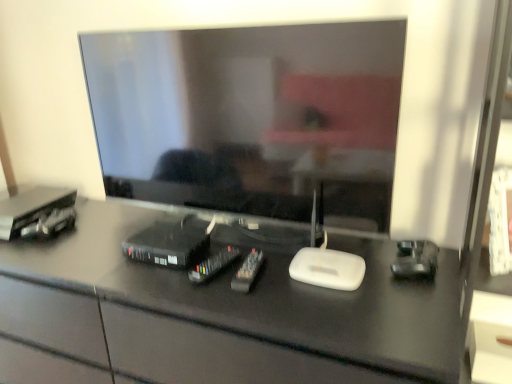
Question: Can you confirm if matte white drawer at lower right is positioned to the right of black plastic remote controls at center, the 4th equipment when ordered from left to right?

Choices:
 (A) no
 (B) yes

Answer: (B)

Question: Is matte white drawer at lower right wider than black plastic remote controls at center, the 4th equipment when ordered from left to right?

Choices:
 (A) no
 (B) yes

Answer: (A)

Question: Is matte white drawer at lower right shorter than black plastic remote controls at center, the 1th equipment when ordered from right to left?

Choices:
 (A) no
 (B) yes

Answer: (A)

Question: Is black plastic remote controls at center, the 4th equipment when ordered from left to right, at the back of matte white drawer at lower right?

Choices:
 (A) yes
 (B) no

Answer: (B)

Question: Is matte white drawer at lower right far away from black plastic remote controls at center, the 4th equipment when ordered from left to right?

Choices:
 (A) yes
 (B) no

Answer: (B)

Question: From the image's perspective, would you say matte white drawer at lower right is shown under black plastic remote controls at center, the 1th equipment when ordered from right to left?

Choices:
 (A) yes
 (B) no

Answer: (A)

Question: Can you confirm if black plastic remote control at center, the 3th equipment in the left-to-right sequence, is shorter than matte black television at center?

Choices:
 (A) no
 (B) yes

Answer: (B)

Question: Is black plastic remote control at center, the 3th equipment in the left-to-right sequence, to the left of matte black television at center from the viewer's perspective?

Choices:
 (A) yes
 (B) no

Answer: (A)

Question: From a real-world perspective, is black plastic remote control at center, the 3th equipment in the left-to-right sequence, over matte black television at center?

Choices:
 (A) yes
 (B) no

Answer: (B)

Question: Does black plastic remote control at center, the second equipment viewed from the right, turn towards matte black television at center?

Choices:
 (A) no
 (B) yes

Answer: (A)

Question: Are black plastic remote control at center, the 3th equipment in the left-to-right sequence, and matte black television at center far apart?

Choices:
 (A) yes
 (B) no

Answer: (B)

Question: Considering the relative sizes of black plastic remote control at center, the second equipment viewed from the right, and matte black television at center in the image provided, is black plastic remote control at center, the second equipment viewed from the right, bigger than matte black television at center?

Choices:
 (A) yes
 (B) no

Answer: (B)

Question: From the image's perspective, is matte black television at center located beneath black glossy desk at center?

Choices:
 (A) yes
 (B) no

Answer: (B)